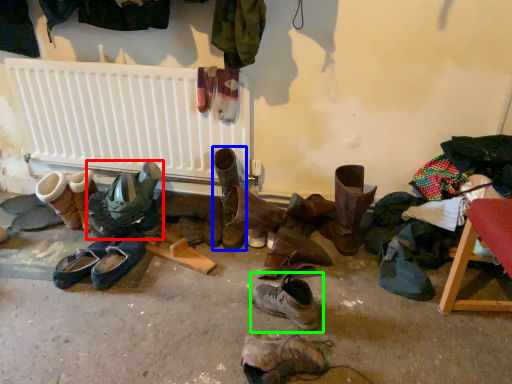
Question: Which object is the closest to the footwear (highlighted by a red box)? Choose among these: footwear (highlighted by a blue box) or footwear (highlighted by a green box).

Choices:
 (A) footwear
 (B) footwear

Answer: (A)